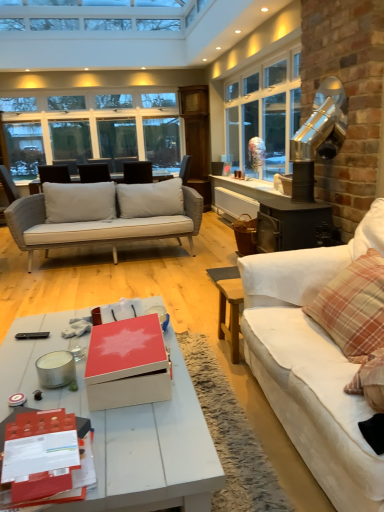
This screenshot has width=384, height=512. What do you see at coordinates (92, 131) in the screenshot?
I see `clear glass window at upper left` at bounding box center [92, 131].

I want to click on white fabric couch at right, so click(x=312, y=365).

This screenshot has height=512, width=384. What do you see at coordinates (123, 428) in the screenshot? I see `white painted wood coffee table at lower center` at bounding box center [123, 428].

In order to face plaid fabric pillow at right, should I rotate leftwards or rightwards?

A 21.512 degree turn to the right will do.

Where is `black plastic remote control at lower left`? Image resolution: width=384 pixels, height=512 pixels. black plastic remote control at lower left is located at coordinates (32, 335).

Can you tell me how much white painted wood coffee table at lower center and plaid fabric pillow at right differ in facing direction?

The angular difference between white painted wood coffee table at lower center and plaid fabric pillow at right is 91.7 degrees.

Which of these two, white painted wood coffee table at lower center or plaid fabric pillow at right, stands shorter?

plaid fabric pillow at right.

Does white painted wood coffee table at lower center lie behind plaid fabric pillow at right?

No, white painted wood coffee table at lower center is in front of plaid fabric pillow at right.

From a real-world perspective, relative to plaid fabric pillow at right, is white painted wood coffee table at lower center vertically above or below?

From a real-world perspective, white painted wood coffee table at lower center is physically below plaid fabric pillow at right.

Is matte red box at center spatially inside plaid fabric pillow at right, or outside of it?

matte red box at center is not inside plaid fabric pillow at right, it's outside.

From the picture: Which object is thinner, matte red box at center or plaid fabric pillow at right?

matte red box at center.

Considering the relative positions of matte red box at center and plaid fabric pillow at right in the image provided, is matte red box at center to the left of plaid fabric pillow at right from the viewer's perspective?

Correct, you'll find matte red box at center to the left of plaid fabric pillow at right.

Which of these two, matte red box at center or plaid fabric pillow at right, is bigger?

Bigger between the two is plaid fabric pillow at right.

From a real-world perspective, which is physically above, matte red box at center or black plastic remote control at lower left?

matte red box at center, from a real-world perspective.

Relative to black plastic remote control at lower left, is matte red box at center in front or behind?

matte red box at center is positioned closer to the viewer than black plastic remote control at lower left.

From the picture: From the image's perspective, is matte red box at center on top of black plastic remote control at lower left?

Indeed, from the image's perspective, matte red box at center is shown above black plastic remote control at lower left.

Can you confirm if matte red box at center is bigger than black plastic remote control at lower left?

Correct, matte red box at center is larger in size than black plastic remote control at lower left.

Is clear glass window at upper left situated inside matte red box at center or outside?

clear glass window at upper left is spatially situated outside matte red box at center.

Based on the photo, who is shorter, clear glass window at upper left or matte red box at center?

With less height is matte red box at center.

Does point (106, 158) lie in front of point (154, 354)?

No, it is not.

Is clear glass window at upper left smaller than matte red box at center?

Incorrect, clear glass window at upper left is not smaller in size than matte red box at center.

Does matte black chair at center have a greater height compared to white painted wood coffee table at lower center?

In fact, matte black chair at center may be shorter than white painted wood coffee table at lower center.

Which of these two, matte black chair at center or white painted wood coffee table at lower center, is smaller?

matte black chair at center.

Does point (150, 168) appear closer or farther from the camera than point (44, 315)?

Point (150, 168).

Choose the correct answer: Is matte black chair at center inside white painted wood coffee table at lower center or outside it?

matte black chair at center is not inside white painted wood coffee table at lower center, it's outside.

Does point (102, 448) lie in front of point (130, 134)?

Yes, point (102, 448) is in front of point (130, 134).

Is clear glass window at upper left at the back of white painted wood coffee table at lower center?

No, white painted wood coffee table at lower center is not facing the opposite direction of clear glass window at upper left.

Can you see white painted wood coffee table at lower center touching clear glass window at upper left?

No, white painted wood coffee table at lower center is not in contact with clear glass window at upper left.

Is white fabric couch at right placed right next to matte black chair at center?

No, white fabric couch at right is not making contact with matte black chair at center.

Between white fabric couch at right and matte black chair at center, which one has larger size?

white fabric couch at right.

How many degrees apart are the facing directions of white fabric couch at right and matte black chair at center?

The angular difference between white fabric couch at right and matte black chair at center is 89 degrees.

From a real-world perspective, is white fabric couch at right beneath matte black chair at center?

Yes, from a real-world perspective, white fabric couch at right is beneath matte black chair at center.

Where is `coffee table on the left of plaid fabric pillow at right`? coffee table on the left of plaid fabric pillow at right is located at coordinates 123,428.

This screenshot has width=384, height=512. What are the coordinates of `pillow lying behind the matte red box at center` in the screenshot? It's located at (354, 307).

From the picture: Estimate the real-world distances between objects in this image. Which object is further from clear glass window at upper left, matte black chair at center or matte red box at center?

Based on the image, matte red box at center appears to be further to clear glass window at upper left.

When comparing their distances from matte red box at center, does white painted wood coffee table at lower center or clear glass window at upper left seem closer?

The object closer to matte red box at center is white painted wood coffee table at lower center.

From the image, which object appears to be farther from white painted wood coffee table at lower center, plaid fabric pillow at right or white fabric couch at right?

Based on the image, plaid fabric pillow at right appears to be further to white painted wood coffee table at lower center.

Based on their spatial positions, is plaid fabric pillow at right or black plastic remote control at lower left further from white painted wood coffee table at lower center?

plaid fabric pillow at right lies further to white painted wood coffee table at lower center than the other object.

Estimate the real-world distances between objects in this image. Which object is further from white painted wood coffee table at lower center, clear glass window at upper left or white fabric couch at right?

clear glass window at upper left.

Which object lies nearer to the anchor point plaid fabric pillow at right, clear glass window at upper left or matte black chair at center?

matte black chair at center is positioned closer to the anchor plaid fabric pillow at right.

Looking at the image, which one is located further to clear glass window at upper left, plaid fabric pillow at right or white fabric couch at right?

plaid fabric pillow at right is positioned further to the anchor clear glass window at upper left.

Looking at this image, looking at the image, which one is located closer to matte red box at center, matte black chair at center or white painted wood coffee table at lower center?

The object closer to matte red box at center is white painted wood coffee table at lower center.

The width and height of the screenshot is (384, 512). What are the coordinates of `remote control between matte red box at center and matte black chair at center in the front-back direction` in the screenshot? It's located at (32, 335).

Find the location of a particular element. box between black plastic remote control at lower left and white fabric couch at right is located at coordinates (127, 364).

Find the location of a particular element. remote control located between white painted wood coffee table at lower center and matte black chair at center in the depth direction is located at coordinates (32, 335).

The height and width of the screenshot is (512, 384). Identify the location of box positioned between white painted wood coffee table at lower center and black plastic remote control at lower left from near to far. (127, 364).